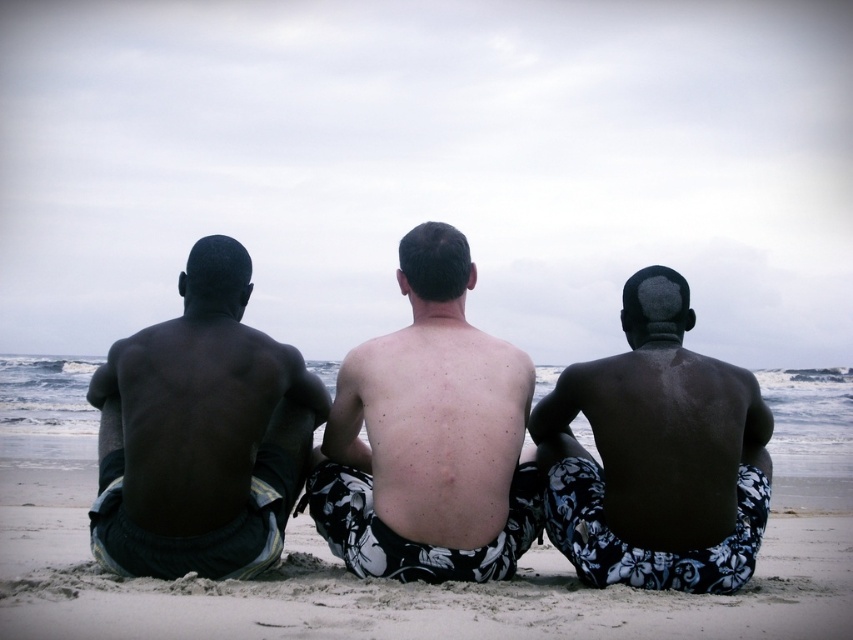
Based on the photo, is sandy beach at center shorter than dark skin man at left?

Indeed, sandy beach at center has a lesser height compared to dark skin man at left.

What do you see at coordinates (399, 582) in the screenshot? I see `sandy beach at center` at bounding box center [399, 582].

Locate an element on the screen. The image size is (853, 640). sandy beach at center is located at coordinates (399, 582).

Does smooth skin back at center lie behind dark skin textured shorts at center?

No, smooth skin back at center is in front of dark skin textured shorts at center.

Identify the location of smooth skin back at center. The width and height of the screenshot is (853, 640). (428, 436).

Based on the photo, which is below, sandy beach at center or dark skin textured shorts at center?

sandy beach at center is lower down.

Between point (375, 580) and point (564, 486), which one is positioned in front?

Point (375, 580) is in front.

Where is `sandy beach at center`? This screenshot has height=640, width=853. sandy beach at center is located at coordinates (x=399, y=582).